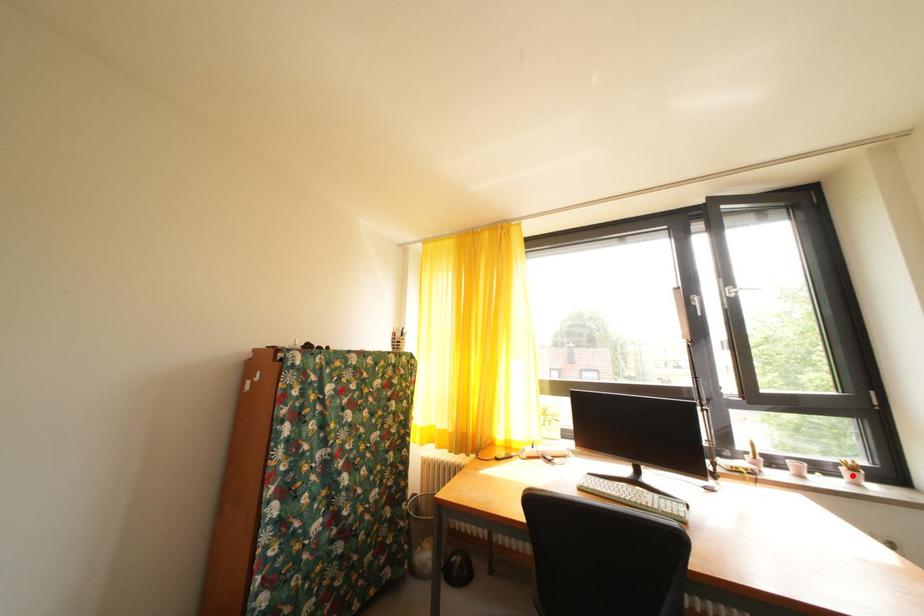
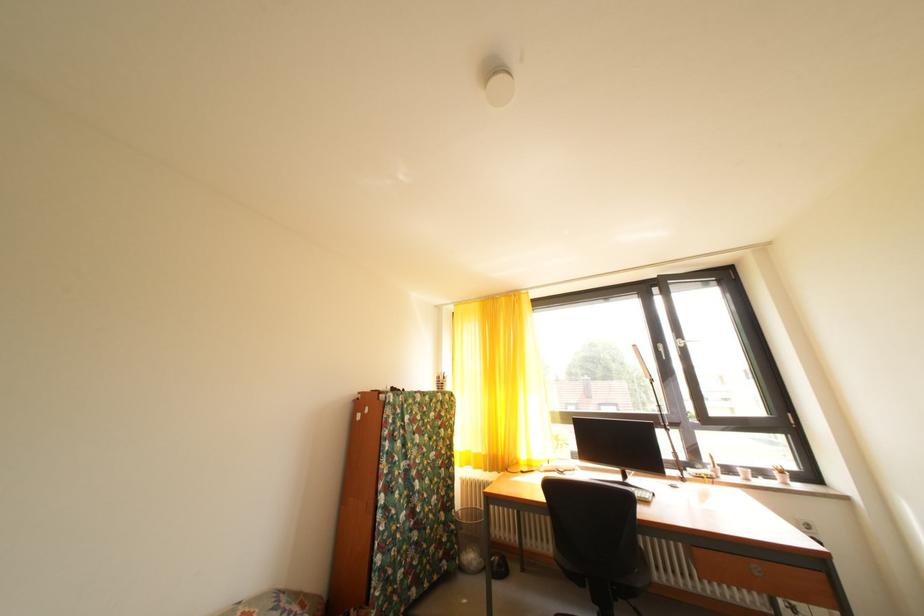
The point at the highlighted location is marked in the first image. Where is the corresponding point in the second image?

(784, 479)